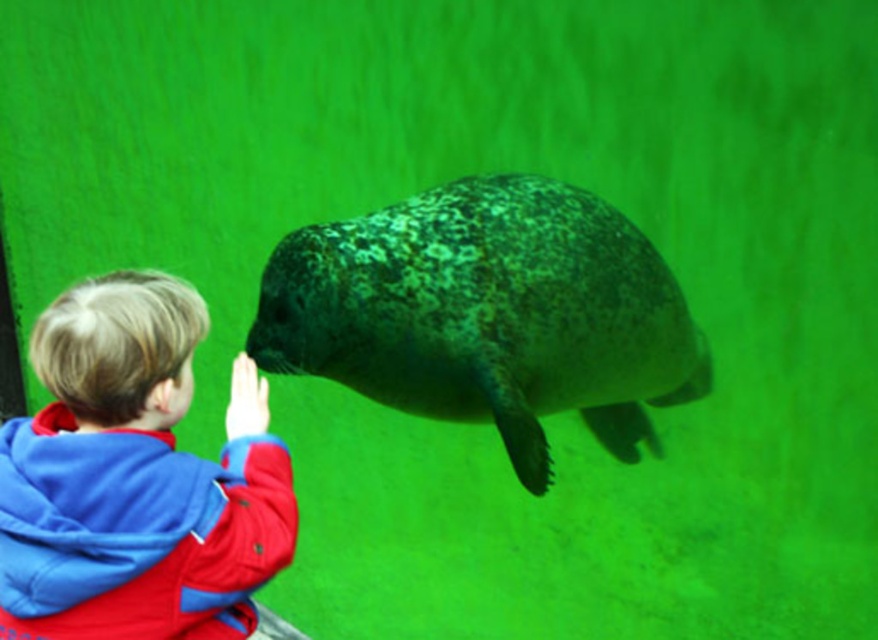
You are a visitor at the aquarium and want to take a photo of the speckled dark green seal at center and the blue fleece jacket at lower left together in the frame. Based on their sizes, will the seal appear larger than the jacket in your photo?

The speckled dark green seal at center is taller than blue fleece jacket at lower left, so yes, the seal will appear larger than the jacket in the photo.

You are a marine biologist observing the aquarium scene. You need to determine which object is wider between the speckled dark green seal at center and the blue fleece jacket at lower left. Based on the scene, which one is wider?

The speckled dark green seal at center is wider than the blue fleece jacket at lower left according to the description.